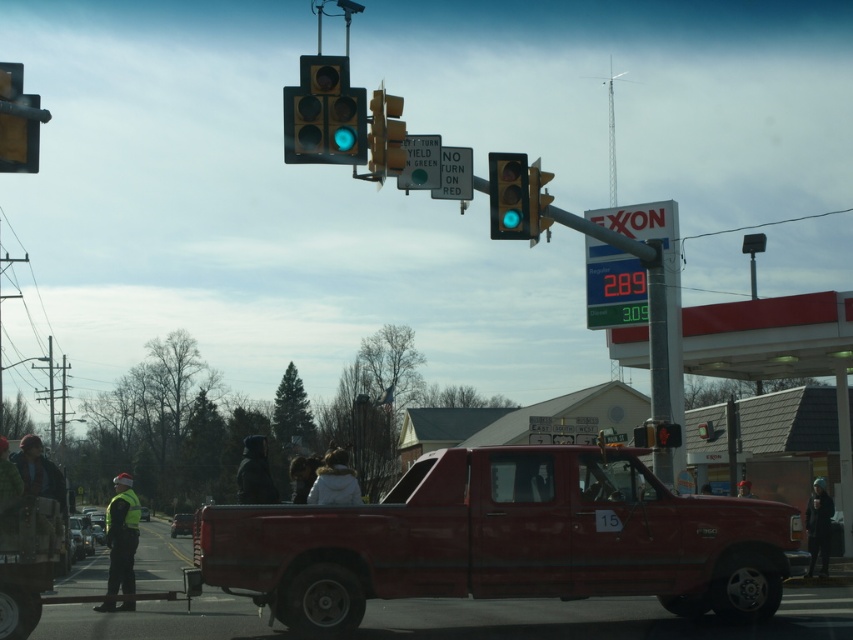
Between point (354, 499) and point (271, 500), which one is positioned behind?

The point (271, 500) is behind.

Between point (341, 474) and point (267, 472), which one is positioned in front?

Positioned in front is point (341, 474).

Identify the location of white fur coat at center. (334, 481).

Who is taller, rustic metal pickup truck at center or matte glass traffic light at upper center?

matte glass traffic light at upper center

Locate an element on the screen. This screenshot has width=853, height=640. rustic metal pickup truck at center is located at coordinates (505, 540).

Between metallic gray pole at center-right and dark fabric jacket at center, which one has less height?

dark fabric jacket at center is shorter.

How distant is metallic gray pole at center-right from dark fabric jacket at center?

6.76 meters

Identify the location of metallic gray pole at center-right. The height and width of the screenshot is (640, 853). (657, 333).